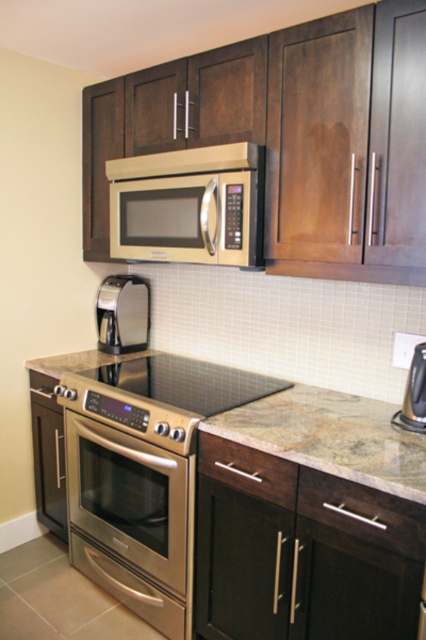
You are standing in the kitchen and want to place a small decorative item on the countertop. You have two options for placement locations, point 1 at coordinates point (x=83, y=432) and point 2 at coordinates point (x=129, y=356). Which point is closer to you, the observer?

Point (x=83, y=432) is closer to the camera than point (x=129, y=356), so the point (x=83, y=432) is closer to you.